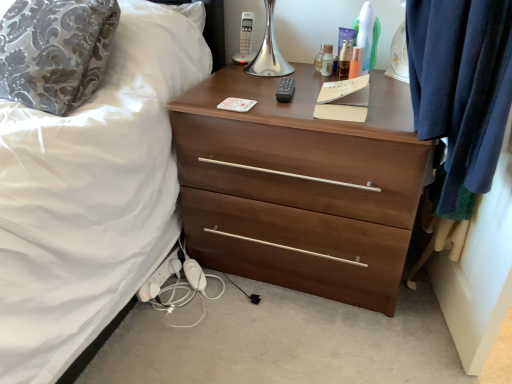
Image resolution: width=512 pixels, height=384 pixels. In order to click on blank space to the left of clear plastic bottle at upper center, the third toiletry viewed from the right in this screenshot , I will do `click(286, 77)`.